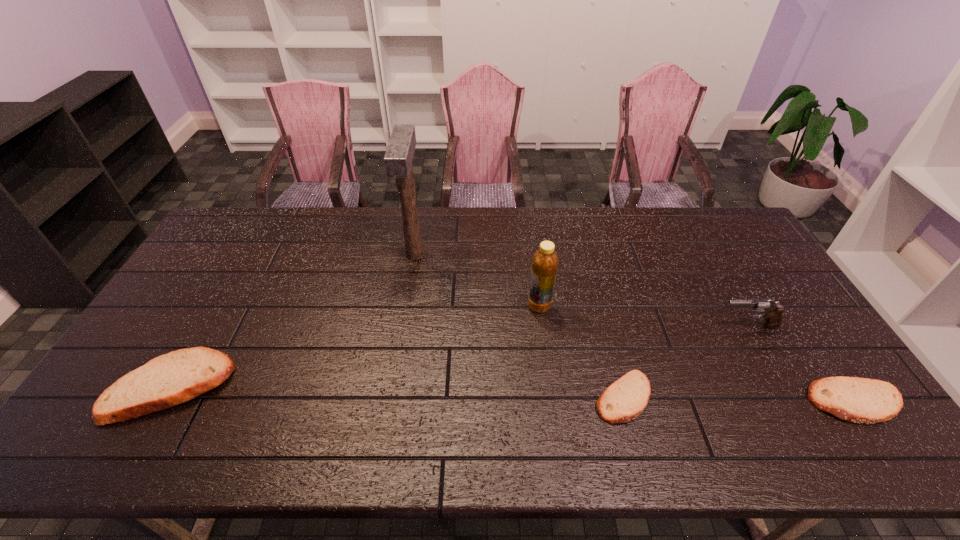
The width and height of the screenshot is (960, 540). Find the location of `the second tallest object`. the second tallest object is located at coordinates (545, 261).

The width and height of the screenshot is (960, 540). I want to click on the fourth object from right to left, so click(545, 261).

Find the location of a particular element. Image resolution: width=960 pixels, height=540 pixels. vacant space situated 0.090m on the right of the leftmost pita bread is located at coordinates (263, 387).

Locate an element on the screen. free space located on the left of the second pita bread from left to right is located at coordinates (530, 397).

This screenshot has height=540, width=960. I want to click on free space located on the back of the second shortest object, so click(x=787, y=302).

Where is `vacant area situated 0.110m on the front of the farthest object`? Image resolution: width=960 pixels, height=540 pixels. vacant area situated 0.110m on the front of the farthest object is located at coordinates (407, 300).

You are a GUI agent. You are given a task and a screenshot of the screen. Output one action in this format:
    pyautogui.click(x=<x>, y=<y>)
    Task: Click on the vacant area situated 0.200m at the barrel of the pistol
    Image resolution: width=960 pixels, height=540 pixels.
    Given the screenshot: What is the action you would take?
    pyautogui.click(x=647, y=326)

Identify the location of vacant space located 0.290m at the barrel of the pistol. The height and width of the screenshot is (540, 960). (616, 326).

You are a GUI agent. You are given a task and a screenshot of the screen. Output one action in this format:
    pyautogui.click(x=<x>, y=<y>)
    Task: Click on the vacant area situated 0.070m at the barrel of the pistol
    
    Given the screenshot: What is the action you would take?
    (692, 326)

The height and width of the screenshot is (540, 960). In order to click on free spot located on the left of the third object from left to right in this screenshot , I will do `click(507, 306)`.